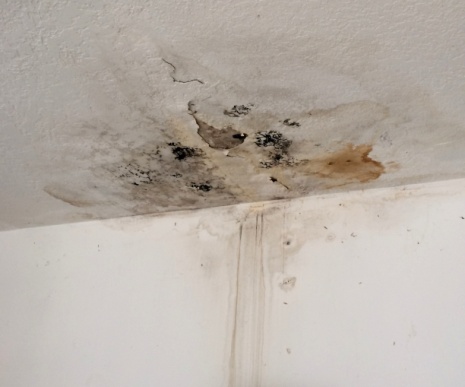
Where is `empty space space on ceiling top right of stains`? This screenshot has height=387, width=465. empty space space on ceiling top right of stains is located at coordinates (385, 42).